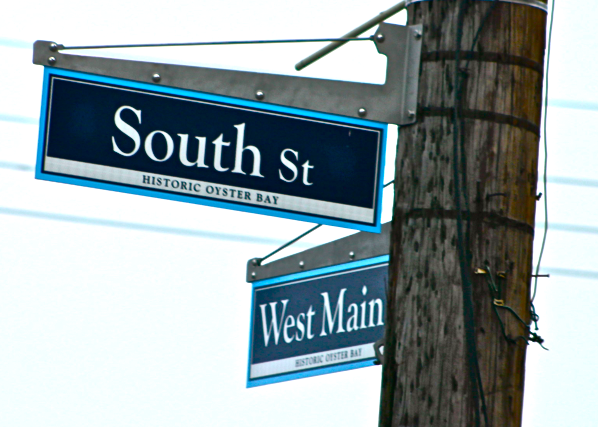
I want to click on cable, so click(457, 223).